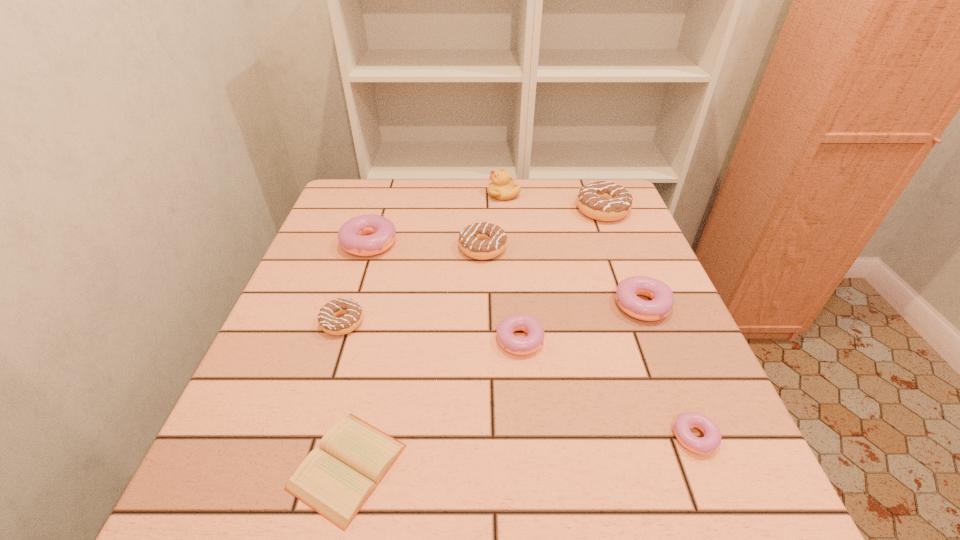
You are a GUI agent. You are given a task and a screenshot of the screen. Output one action in this format:
    pyautogui.click(x=<x>, y=<y>)
    Task: Click on the object that is the third closest to the biggest purple doughnut
    The width and height of the screenshot is (960, 540).
    Given the screenshot: What is the action you would take?
    pyautogui.click(x=502, y=188)

Locate which doughnut is the fifth closest to the diary. Please provide its 2D coordinates. Your answer should be formatted as a tuple, i.e. [(x, y)], where the tuple contains the x and y coordinates of a point satisfying the conditions above.

[(712, 438)]

Locate an element on the screen. The image size is (960, 540). doughnut that can be found as the second closest to the duckling is located at coordinates (482, 241).

Select which chocolate doughnut appears as the third closest to the diary. Please provide its 2D coordinates. Your answer should be formatted as a tuple, i.e. [(x, y)], where the tuple contains the x and y coordinates of a point satisfying the conditions above.

[(600, 200)]

The width and height of the screenshot is (960, 540). I want to click on chocolate doughnut object that ranks as the third closest to the nearest doughnut, so click(x=353, y=314).

At what (x,y) coordinates should I click in order to perform the action: click on purple doughnut object that ranks as the second closest to the third purple doughnut from right to left. Please return your answer as a coordinate pair (x, y). Looking at the image, I should click on (712, 438).

Identify which purple doughnut is the fourth nearest to the yellow duckling. Please provide its 2D coordinates. Your answer should be formatted as a tuple, i.e. [(x, y)], where the tuple contains the x and y coordinates of a point satisfying the conditions above.

[(712, 438)]

The height and width of the screenshot is (540, 960). Identify the location of vacant point that satisfies the following two spatial constraints: 1. on the front-facing side of the third smallest purple doughnut; 2. on the right side of the duckling. (513, 310).

The image size is (960, 540). Find the location of `vacant space that satisfies the following two spatial constraints: 1. on the front-facing side of the yellow duckling; 2. on the left side of the third smallest purple doughnut`. vacant space that satisfies the following two spatial constraints: 1. on the front-facing side of the yellow duckling; 2. on the left side of the third smallest purple doughnut is located at coordinates (513, 310).

The height and width of the screenshot is (540, 960). What are the coordinates of `vacant point that satisfies the following two spatial constraints: 1. on the back side of the third biggest purple doughnut; 2. on the right side of the biggest chocolate doughnut` in the screenshot? It's located at (509, 210).